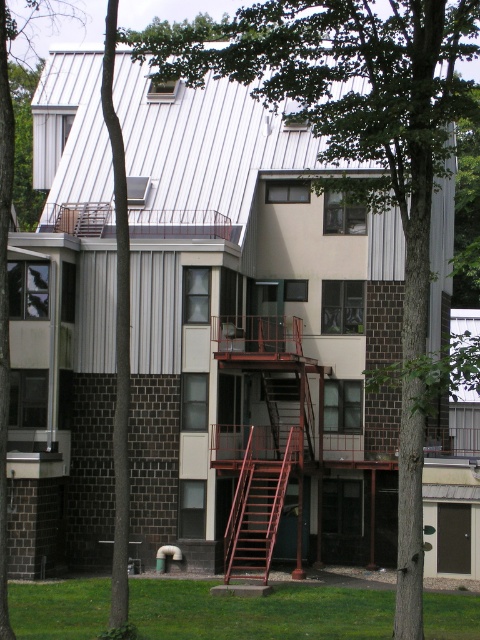
Which is behind, point (23, 17) or point (276, 452)?

Point (23, 17)

Does green leafy tree at center have a larger size compared to metallic red staircase at center?

Correct, green leafy tree at center is larger in size than metallic red staircase at center.

Which is behind, point (1, 307) or point (277, 417)?

The point (277, 417) is behind.

You are a GUI agent. You are given a task and a screenshot of the screen. Output one action in this format:
    pyautogui.click(x=<x>, y=<y>)
    Task: Click on the green leafy tree at center
    
    Given the screenshot: What is the action you would take?
    pyautogui.click(x=6, y=266)

Does rusty metal fire escape at center have a lesser width compared to green leafy tree at center?

Yes.

Does rusty metal fire escape at center have a smaller size compared to green leafy tree at center?

Yes, rusty metal fire escape at center is smaller than green leafy tree at center.

Is point (292, 432) closer to camera compared to point (7, 45)?

Yes, point (292, 432) is in front of point (7, 45).

What are the coordinates of `rusty metal fire escape at center` in the screenshot? It's located at (264, 440).

Who is shorter, rusty metal fire escape at center or rusty metal staircase at center?

Standing shorter between the two is rusty metal staircase at center.

Does rusty metal fire escape at center have a lesser width compared to rusty metal staircase at center?

No, rusty metal fire escape at center is not thinner than rusty metal staircase at center.

Image resolution: width=480 pixels, height=640 pixels. Describe the element at coordinates (264, 440) in the screenshot. I see `rusty metal fire escape at center` at that location.

Locate an element on the screen. rusty metal fire escape at center is located at coordinates (264, 440).